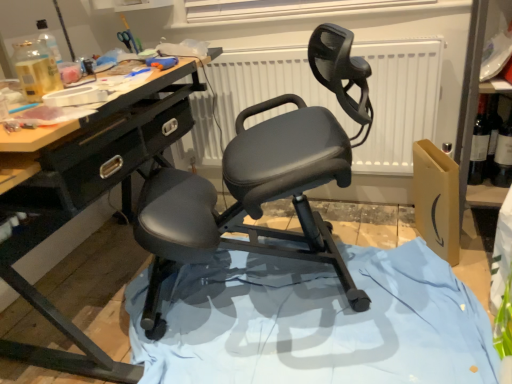
Find the location of a particular element. blue fabric at center is located at coordinates (315, 322).

Find the location of a particular element. The image size is (512, 384). blue fabric at center is located at coordinates (315, 322).

Find the location of a particular element. This screenshot has width=512, height=384. bottle that is behind the matte black ergonomic chair at center is located at coordinates (503, 156).

From the image's perspective, is matte black ergonomic chair at center positioned above or below dark glass wine bottle at right?

Based on their image positions, matte black ergonomic chair at center is located beneath dark glass wine bottle at right.

Looking at this image, considering the relative positions of matte black ergonomic chair at center and dark glass wine bottle at right in the image provided, is matte black ergonomic chair at center in front of dark glass wine bottle at right?

Yes.

Between point (258, 166) and point (510, 172), which one is positioned in front?

Positioned in front is point (258, 166).

Measure the distance from dark glass wine bottle at right to white matte window screen at upper center.

31.06 inches.

This screenshot has height=384, width=512. I want to click on window screen above the dark glass wine bottle at right (from a real-world perspective), so click(280, 8).

Does point (490, 181) come behind point (192, 3)?

No, (490, 181) is in front of (192, 3).

Which object is thinner, dark glass wine bottle at right or white matte window screen at upper center?

Thinner between the two is white matte window screen at upper center.

Is blue fabric at center positioned with its back to white matte window screen at upper center?

No.

Is blue fabric at center bigger or smaller than white matte window screen at upper center?

Clearly, blue fabric at center is larger in size than white matte window screen at upper center.

Can you confirm if blue fabric at center is thinner than white matte window screen at upper center?

Incorrect, the width of blue fabric at center is not less than that of white matte window screen at upper center.

Which is more to the right, blue fabric at center or white matte window screen at upper center?

white matte window screen at upper center is more to the right.

Is matte black ergonomic chair at center looking in the opposite direction of blue fabric at center?

matte black ergonomic chair at center does not have its back to blue fabric at center.

Which is in front, matte black ergonomic chair at center or blue fabric at center?

matte black ergonomic chair at center is in front.

Would you say blue fabric at center is part of matte black ergonomic chair at center's contents?

Yes, blue fabric at center is a part of matte black ergonomic chair at center.

From the picture: Is the surface of matte black ergonomic chair at center in direct contact with white matte radiator at center?

They are not placed beside each other.

From a real-world perspective, which object stands above the other?

In real-world perspective, white matte radiator at center is above.

Looking at this image, is matte black ergonomic chair at center turned away from white matte radiator at center?

Yes.

How different are the orientations of dark glass wine bottle at right and blue fabric at center in degrees?

They differ by 169 degrees in their facing directions.

Between dark glass wine bottle at right and blue fabric at center, which one has larger width?

blue fabric at center is wider.

Is dark glass wine bottle at right far away from blue fabric at center?

No, dark glass wine bottle at right is in close proximity to blue fabric at center.

Is dark glass wine bottle at right at the right side of blue fabric at center?

Yes, dark glass wine bottle at right is to the right of blue fabric at center.

Is dark glass wine bottle at right completely or partially outside of matte black ergonomic chair at center?

Indeed, dark glass wine bottle at right is completely outside matte black ergonomic chair at center.

What's the angular difference between dark glass wine bottle at right and matte black ergonomic chair at center's facing directions?

24.6 degrees.

Considering the sizes of objects dark glass wine bottle at right and matte black ergonomic chair at center in the image provided, who is shorter, dark glass wine bottle at right or matte black ergonomic chair at center?

With less height is dark glass wine bottle at right.

Considering the points (500, 130) and (338, 137), which point is in front, point (500, 130) or point (338, 137)?

Positioned in front is point (338, 137).

At what (x,y) coordinates should I click in order to perform the action: click on bottle above the matte black ergonomic chair at center (from the image's perspective). Please return your answer as a coordinate pair (x, y). This screenshot has height=384, width=512. Looking at the image, I should click on (503, 156).

Identify the location of bottle in front of the white matte window screen at upper center. (503, 156).

Looking at the image, which one is located closer to blue fabric at center, white matte window screen at upper center or matte black ergonomic chair at center?

matte black ergonomic chair at center is positioned closer to the anchor blue fabric at center.

From the image, which object appears to be nearer to white matte window screen at upper center, matte black ergonomic chair at center or dark glass wine bottle at right?

Among the two, matte black ergonomic chair at center is located nearer to white matte window screen at upper center.

From the image, which object appears to be nearer to matte black ergonomic chair at center, dark glass wine bottle at right or white matte window screen at upper center?

Among the two, white matte window screen at upper center is located nearer to matte black ergonomic chair at center.

Looking at this image, based on their spatial positions, is white matte radiator at center or matte black ergonomic chair at center closer to white matte window screen at upper center?

white matte radiator at center is closer to white matte window screen at upper center.

Considering their positions, is white matte radiator at center positioned further to dark glass wine bottle at right than matte black ergonomic chair at center?

matte black ergonomic chair at center is positioned further to the anchor dark glass wine bottle at right.

Estimate the real-world distances between objects in this image. Which object is closer to white matte window screen at upper center, matte black ergonomic chair at center or white matte radiator at center?

white matte radiator at center is positioned closer to the anchor white matte window screen at upper center.

Considering their positions, is matte black ergonomic chair at center positioned closer to blue fabric at center than white matte window screen at upper center?

matte black ergonomic chair at center lies closer to blue fabric at center than the other object.

From the image, which object appears to be farther from blue fabric at center, dark glass wine bottle at right or white matte radiator at center?

Based on the image, dark glass wine bottle at right appears to be further to blue fabric at center.

Locate an element on the screen. The width and height of the screenshot is (512, 384). radiator between matte black ergonomic chair at center and dark glass wine bottle at right is located at coordinates (399, 102).

At what (x,y) coordinates should I click in order to perform the action: click on radiator that lies between white matte window screen at upper center and blue fabric at center from top to bottom. Please return your answer as a coordinate pair (x, y). Looking at the image, I should click on (399, 102).

The image size is (512, 384). In order to click on radiator situated between blue fabric at center and dark glass wine bottle at right from left to right in this screenshot , I will do point(399,102).

In order to click on fabric between matte black ergonomic chair at center and white matte radiator at center along the z-axis in this screenshot , I will do `click(315, 322)`.